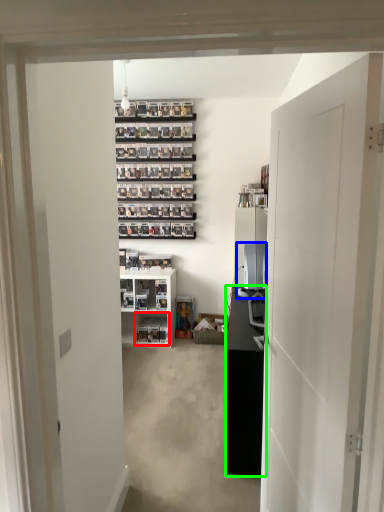
Question: Which object is the farthest from shelf (highlighted by a red box)? Choose among these: desktop computer (highlighted by a blue box) or cabinetry (highlighted by a green box).

Choices:
 (A) desktop computer
 (B) cabinetry

Answer: (B)